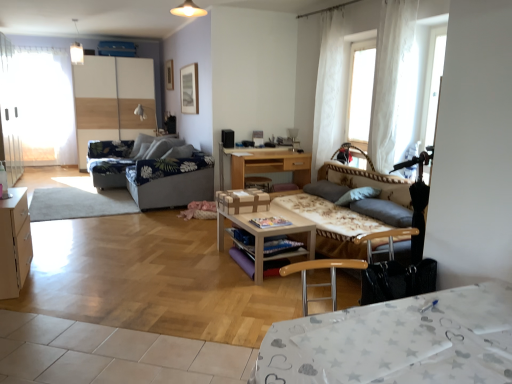
Locate an element on the screen. This screenshot has height=384, width=512. unoccupied space behind light wood cabinet at left is located at coordinates (57, 258).